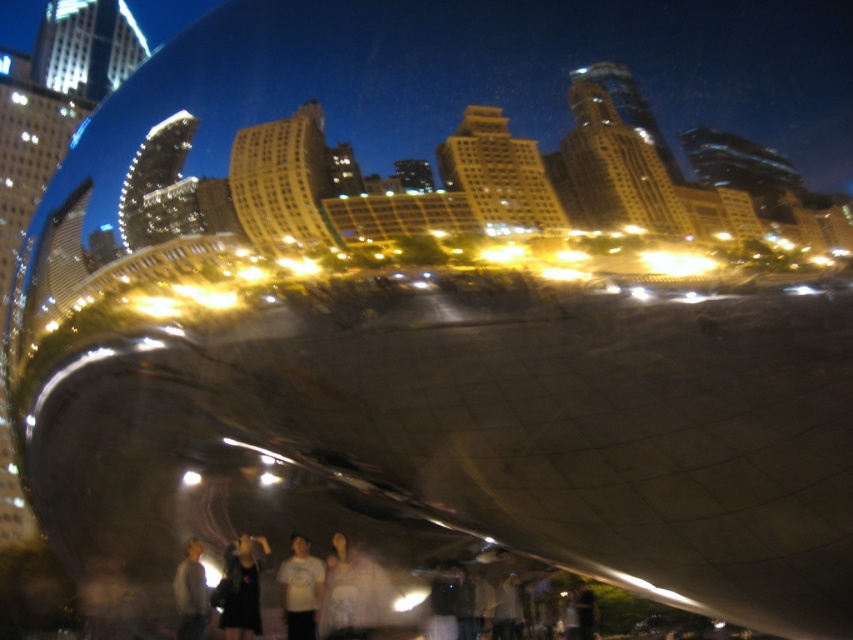
Question: Which object appears farthest from the camera in this image?

Choices:
 (A) dark gray fabric at lower center
 (B) white matte t-shirt at center
 (C) gray fabric shirt at lower left

Answer: (B)

Question: Is dark gray fabric at lower center wider than white matte t-shirt at center?

Choices:
 (A) no
 (B) yes

Answer: (A)

Question: Does white matte t-shirt at center have a lesser width compared to gray fabric shirt at lower left?

Choices:
 (A) yes
 (B) no

Answer: (A)

Question: Is white matte t-shirt at center in front of gray fabric shirt at lower left?

Choices:
 (A) yes
 (B) no

Answer: (B)

Question: Which object is positioned closest to the white matte t-shirt at center?

Choices:
 (A) gray fabric shirt at lower left
 (B) dark gray fabric at lower center

Answer: (B)

Question: Which of the following is the closest to the observer?

Choices:
 (A) dark gray fabric at lower center
 (B) gray fabric shirt at lower left

Answer: (B)